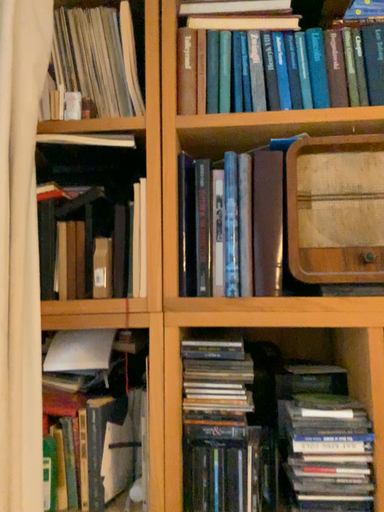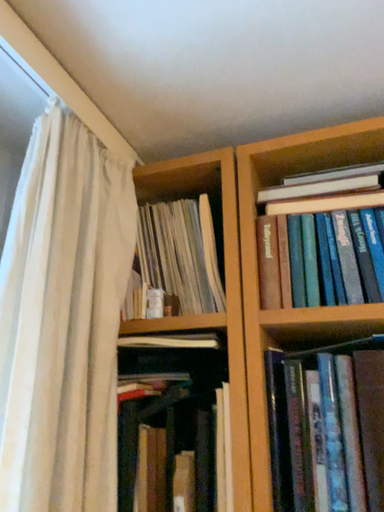
Question: Which way did the camera rotate in the video?

Choices:
 (A) rotated left
 (B) rotated right

Answer: (A)